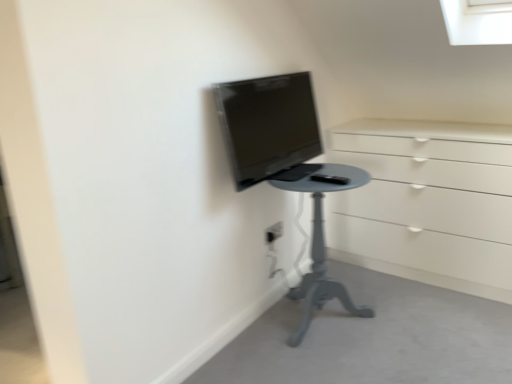
Question: Is smooth gray table at lower center taller or shorter than white plastic electric outlet at center?

Choices:
 (A) tall
 (B) short

Answer: (B)

Question: From the image's perspective, is smooth gray table at lower center above or below white plastic electric outlet at center?

Choices:
 (A) below
 (B) above

Answer: (A)

Question: Which object is the closest to the matte gray table at center?

Choices:
 (A) white plastic electric outlet at center
 (B) smooth gray table at lower center
 (C) matte black monitor at center

Answer: (B)

Question: Which of these objects is positioned farthest from the matte gray table at center?

Choices:
 (A) smooth gray table at lower center
 (B) white plastic electric outlet at center
 (C) matte black monitor at center

Answer: (C)